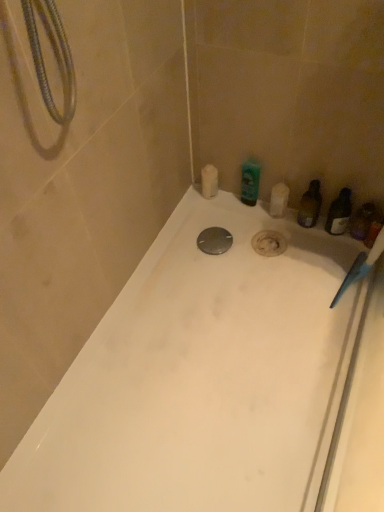
Where is `vacant area that is in front of translucent plastic bottle at right, placed as the 1th toiletry when sorted from right to left`? The height and width of the screenshot is (512, 384). vacant area that is in front of translucent plastic bottle at right, placed as the 1th toiletry when sorted from right to left is located at coordinates (353, 278).